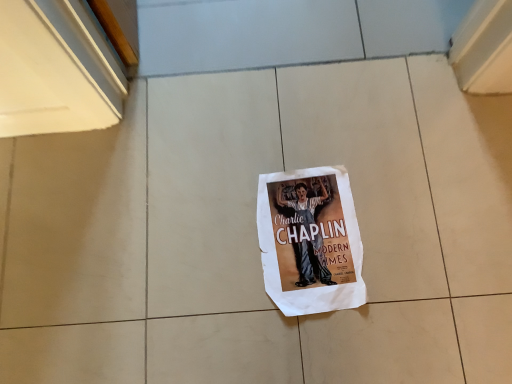
The image size is (512, 384). Find the location of `free space above white paper poster at center (from a real-world perspective)`. free space above white paper poster at center (from a real-world perspective) is located at coordinates (308, 209).